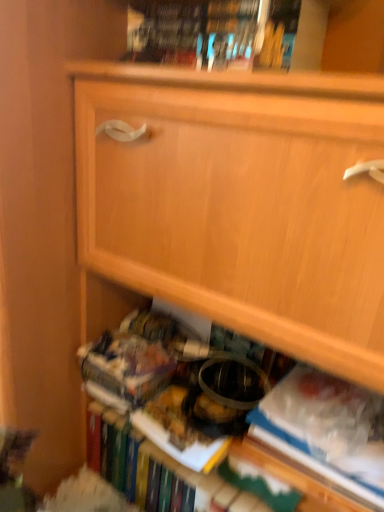
Find the location of a particular element. This screenshot has width=384, height=512. free space above white paper at lower right (from a real-world perspective) is located at coordinates (311, 420).